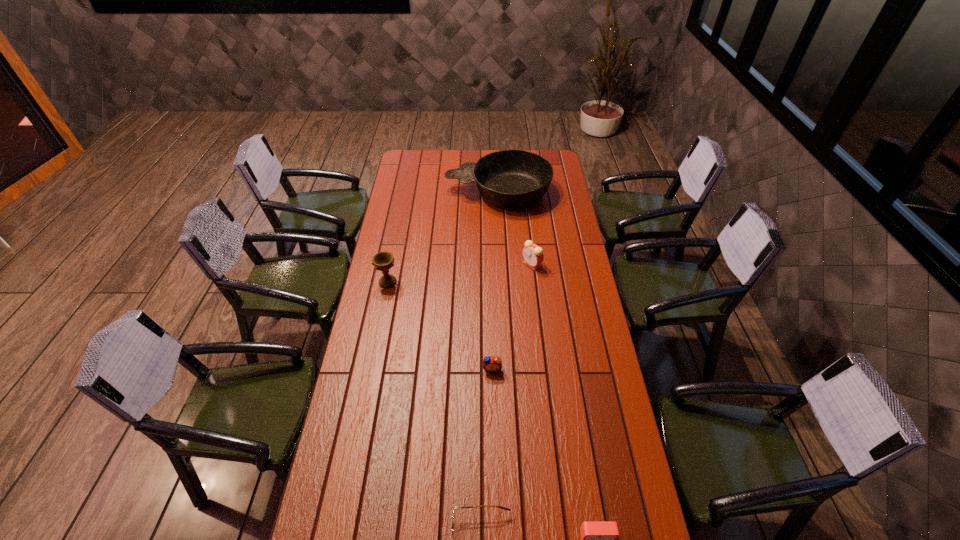
The width and height of the screenshot is (960, 540). Identify the location of free region located 0.120m on the back of the fourth nearest object. pos(393,255).

Find the location of a particular element. The height and width of the screenshot is (540, 960). vacant space located 0.250m on the face of the third tallest object is located at coordinates (466, 265).

Image resolution: width=960 pixels, height=540 pixels. I want to click on blank area located on the face of the third tallest object, so click(x=439, y=265).

The width and height of the screenshot is (960, 540). What are the coordinates of `vacant space situated 0.190m on the face of the third tallest object` in the screenshot? It's located at (479, 265).

Where is `blank space located 0.330m on the front-facing side of the leftmost alarm clock`? The width and height of the screenshot is (960, 540). blank space located 0.330m on the front-facing side of the leftmost alarm clock is located at coordinates (494, 468).

Locate an element on the screen. The width and height of the screenshot is (960, 540). object that is at the far edge is located at coordinates click(x=512, y=179).

I want to click on object that is at the left edge, so click(x=383, y=261).

Find the location of a particular element. The width and height of the screenshot is (960, 540). object that is at the right edge is located at coordinates (512, 179).

Image resolution: width=960 pixels, height=540 pixels. I want to click on object located at the far right corner, so click(512, 179).

This screenshot has height=540, width=960. I want to click on vacant area at the far edge, so click(482, 155).